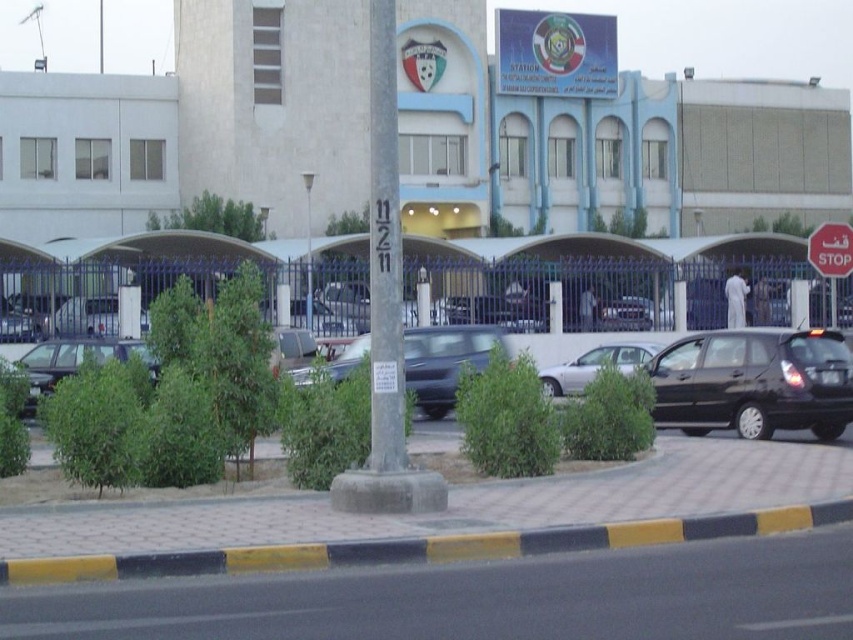
Question: Is metallic gray sedan at center thinner than red matte stop sign at upper right?

Choices:
 (A) yes
 (B) no

Answer: (A)

Question: Does white concrete building at center appear on the left side of red matte stop sign at upper right?

Choices:
 (A) no
 (B) yes

Answer: (B)

Question: Considering the real-world distances, which object is farthest from the white concrete building at center?

Choices:
 (A) matte black car at lower left
 (B) metallic gray sedan at center

Answer: (B)

Question: Which object is closer to the camera taking this photo?

Choices:
 (A) metallic gray sedan at center
 (B) white concrete building at center
 (C) silver metallic sedan at center

Answer: (C)

Question: Which point is closer to the camera taking this photo?

Choices:
 (A) (42, 358)
 (B) (550, 390)
 (C) (831, 225)

Answer: (C)

Question: Is shiny black car at right thinner than matte black car at lower left?

Choices:
 (A) no
 (B) yes

Answer: (B)